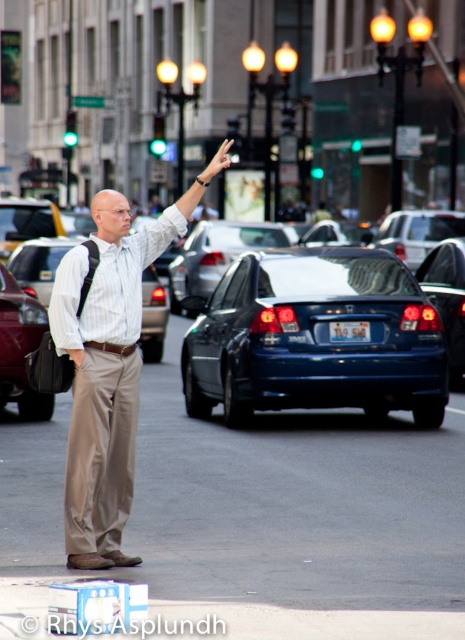
Question: Which object is farther from the camera taking this photo?

Choices:
 (A) light brown cotton pants at center
 (B) matte black car at center

Answer: (B)

Question: Which object is the farthest from the blue metallic sedan at center?

Choices:
 (A) green glass traffic light at upper left
 (B) light brown cotton pants at center
 (C) blue plastic license plate at center

Answer: (A)

Question: Which point is closer to the camera?

Choices:
 (A) blue metallic sedan at center
 (B) glossy black car at center
 (C) blue plastic license plate at center
 (D) light brown cotton pants at center

Answer: (D)

Question: Is shiny blue sedan at center positioned in front of blue plastic license plate at center?

Choices:
 (A) yes
 (B) no

Answer: (B)

Question: Is blue glossy sedan at center smaller than glossy black car at center?

Choices:
 (A) yes
 (B) no

Answer: (B)

Question: Where is shiny blue sedan at center located in relation to green glass traffic light at upper left in the image?

Choices:
 (A) above
 (B) below

Answer: (B)